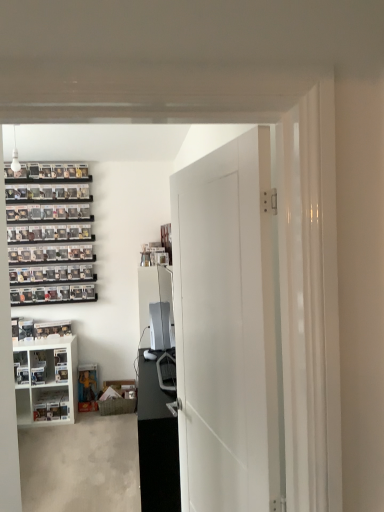
Question: From a real-world perspective, is black glossy entertainment center at center positioned above or below white matte door at center?

Choices:
 (A) above
 (B) below

Answer: (B)

Question: Is black glossy entertainment center at center taller or shorter than white matte door at center?

Choices:
 (A) tall
 (B) short

Answer: (B)

Question: Which of these objects is positioned farthest from the white glossy cabinet at lower left?

Choices:
 (A) black glossy entertainment center at center
 (B) white plastic shelf at lower left
 (C) white matte door at center

Answer: (C)

Question: Considering the real-world distances, which object is farthest from the white matte door at center?

Choices:
 (A) black glossy entertainment center at center
 (B) white glossy cabinet at lower left
 (C) white plastic shelf at lower left

Answer: (C)